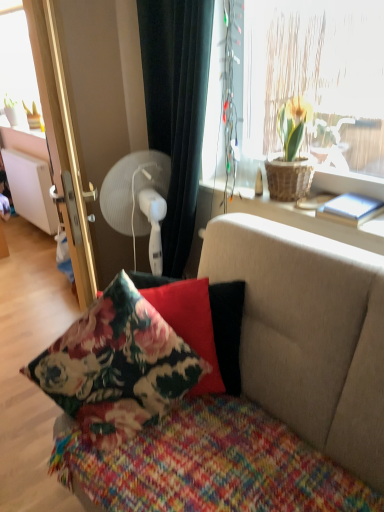
This screenshot has width=384, height=512. Describe the element at coordinates (190, 323) in the screenshot. I see `floral fabric pillow at center, the 1th pillow from the back` at that location.

Describe the element at coordinates (309, 334) in the screenshot. This screenshot has width=384, height=512. I see `floral fabric couch at center` at that location.

In order to face floral fabric cushion at center, which is the first pillow from front to back, should I rotate leftwards or rightwards?

To face it directly, rotate left by 10.633 degrees.

You are a GUI agent. You are given a task and a screenshot of the screen. Output one action in this format:
    pyautogui.click(x=<x>, y=<y>)
    Task: Click on the knitted multicolored blanket at center
    Image resolution: width=384 pixels, height=512 pixels.
    Given the screenshot: What is the action you would take?
    pyautogui.click(x=212, y=466)

What is the approximate height of knitted multicolored blanket at center?

It is 8.01 inches.

Image resolution: width=384 pixels, height=512 pixels. What are the coordinates of `brown woven basket at upper right` in the screenshot? It's located at click(291, 153).

Locate an element on the screen. The height and width of the screenshot is (512, 384). floral fabric pillow at center, placed as the second pillow when sorted from front to back is located at coordinates [x=190, y=323].

How many degrees apart are the facing directions of white plastic fan at upper left and black fabric curtain at upper center?

108 degrees.

Is black fabric curtain at upper center inside white plastic fan at upper left?

No, black fabric curtain at upper center is not a part of white plastic fan at upper left.

Who is shorter, white plastic fan at upper left or black fabric curtain at upper center?

white plastic fan at upper left is shorter.

Is point (136, 184) more distant than point (198, 74)?

Yes, point (136, 184) is farther from viewer.

Between floral fabric couch at center and black fabric curtain at upper center, which one is positioned in front?

floral fabric couch at center is closer to the camera.

From the image's perspective, which object appears higher, floral fabric couch at center or black fabric curtain at upper center?

From the image's view, black fabric curtain at upper center is above.

Are floral fabric couch at center and black fabric curtain at upper center beside each other?

There is a gap between floral fabric couch at center and black fabric curtain at upper center.

Is brown woven basket at upper right wider or thinner than white plastic fan at upper left?

In the image, brown woven basket at upper right appears to be more narrow than white plastic fan at upper left.

Is brown woven basket at upper right positioned far away from white plastic fan at upper left?

They are positioned close to each other.

Considering the sizes of objects brown woven basket at upper right and white plastic fan at upper left in the image provided, who is bigger, brown woven basket at upper right or white plastic fan at upper left?

Bigger between the two is white plastic fan at upper left.

How many degrees apart are the facing directions of brown woven basket at upper right and white plastic fan at upper left?

107 degrees separate the facing orientations of brown woven basket at upper right and white plastic fan at upper left.

Does floral fabric couch at center have a greater width compared to white matte radiator at left?

Correct, the width of floral fabric couch at center exceeds that of white matte radiator at left.

Is floral fabric couch at center at the left side of white matte radiator at left?

No.

Would you say white matte radiator at left is part of floral fabric couch at center's contents?

No, white matte radiator at left is not surrounded by floral fabric couch at center.

Is floral fabric couch at center looking in the opposite direction of white matte radiator at left?

No.

In terms of size, does white plastic fan at upper left appear bigger or smaller than knitted multicolored blanket at center?

In the image, white plastic fan at upper left appears to be smaller than knitted multicolored blanket at center.

How different are the orientations of white plastic fan at upper left and knitted multicolored blanket at center in degrees?

The angle between the facing direction of white plastic fan at upper left and the facing direction of knitted multicolored blanket at center is 106 degrees.

Considering the relative sizes of white plastic fan at upper left and knitted multicolored blanket at center in the image provided, is white plastic fan at upper left shorter than knitted multicolored blanket at center?

No.

Which is farther from the camera, (152, 150) or (177, 502)?

The point (152, 150) is farther.

Is white plastic fan at upper left next to woven wicker basket at upper right and touching it?

No, white plastic fan at upper left is not with woven wicker basket at upper right.

Is woven wicker basket at upper right at the back of white plastic fan at upper left?

No, white plastic fan at upper left's orientation is not away from woven wicker basket at upper right.

From the image's perspective, which one is positioned lower, white plastic fan at upper left or woven wicker basket at upper right?

woven wicker basket at upper right.

The height and width of the screenshot is (512, 384). In order to click on mechanical fan behind the woven wicker basket at upper right in this screenshot , I will do `click(133, 191)`.

From a real-world perspective, does black fabric curtain at upper center sit lower than woven wicker basket at upper right?

No, from a real-world perspective, black fabric curtain at upper center is not under woven wicker basket at upper right.

From the image's perspective, is black fabric curtain at upper center over woven wicker basket at upper right?

Indeed, from the image's perspective, black fabric curtain at upper center is shown above woven wicker basket at upper right.

Considering the positions of objects black fabric curtain at upper center and woven wicker basket at upper right in the image provided, who is behind, black fabric curtain at upper center or woven wicker basket at upper right?

woven wicker basket at upper right.

Consider the image. How many degrees apart are the facing directions of black fabric curtain at upper center and woven wicker basket at upper right?

The angle between the facing direction of black fabric curtain at upper center and the facing direction of woven wicker basket at upper right is 0.875 degrees.

Image resolution: width=384 pixels, height=512 pixels. I want to click on curtain in front of the white plastic fan at upper left, so click(x=177, y=106).

In order to click on studio couch below the black fabric curtain at upper center (from the image's perspective) in this screenshot , I will do `click(309, 334)`.

Considering their positions, is brown woven basket at upper right positioned further to floral fabric cushion at center, the 2th pillow when ordered from back to front, than woven wicker basket at upper right?

brown woven basket at upper right is positioned further to the anchor floral fabric cushion at center, the 2th pillow when ordered from back to front.

From the image, which object appears to be farther from floral fabric pillow at center, placed as the second pillow when sorted from front to back, black fabric curtain at upper center or floral fabric couch at center?

black fabric curtain at upper center is further to floral fabric pillow at center, placed as the second pillow when sorted from front to back.

Estimate the real-world distances between objects in this image. Which object is closer to floral fabric couch at center, brown woven basket at upper right or woven wicker basket at upper right?

Among the two, woven wicker basket at upper right is located nearer to floral fabric couch at center.

Considering their positions, is brown woven basket at upper right positioned closer to black fabric curtain at upper center than woven wicker basket at upper right?

Based on the image, woven wicker basket at upper right appears to be nearer to black fabric curtain at upper center.

When comparing their distances from white plastic fan at upper left, does metallic gold screen door at left or floral fabric cushion at center, which is the first pillow from front to back, seem further?

Based on the image, floral fabric cushion at center, which is the first pillow from front to back, appears to be further to white plastic fan at upper left.

Looking at the image, which one is located further to white matte radiator at left, metallic gold screen door at left or floral fabric pillow at center, placed as the second pillow when sorted from front to back?

The object further to white matte radiator at left is floral fabric pillow at center, placed as the second pillow when sorted from front to back.

Looking at the image, which one is located further to black fabric curtain at upper center, woven wicker basket at upper right or metallic gold screen door at left?

metallic gold screen door at left.

Based on their spatial positions, is woven wicker basket at upper right or floral fabric pillow at center, placed as the second pillow when sorted from front to back, closer to floral fabric cushion at center, the 2th pillow when ordered from back to front?

floral fabric pillow at center, placed as the second pillow when sorted from front to back, is positioned closer to the anchor floral fabric cushion at center, the 2th pillow when ordered from back to front.

Where is `mechanical fan between brown woven basket at upper right and white matte radiator at left along the z-axis`? This screenshot has height=512, width=384. mechanical fan between brown woven basket at upper right and white matte radiator at left along the z-axis is located at coordinates (133, 191).

This screenshot has height=512, width=384. Find the location of `screen door between black fabric curtain at upper center and floral fabric couch at center from top to bottom`. screen door between black fabric curtain at upper center and floral fabric couch at center from top to bottom is located at coordinates (61, 137).

Locate an element on the screen. houseplant between black fabric curtain at upper center and white matte radiator at left from front to back is located at coordinates click(291, 153).

Locate an element on the screen. houseplant between black fabric curtain at upper center and floral fabric couch at center from top to bottom is located at coordinates (291, 153).